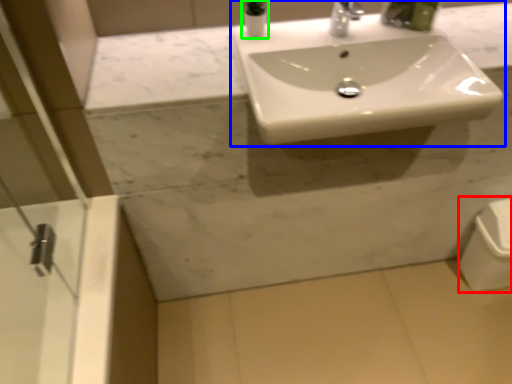
Question: Which object is positioned farthest from porcelain (highlighted by a red box)? Select from sink (highlighted by a blue box) and toiletry (highlighted by a green box).

Choices:
 (A) sink
 (B) toiletry

Answer: (B)